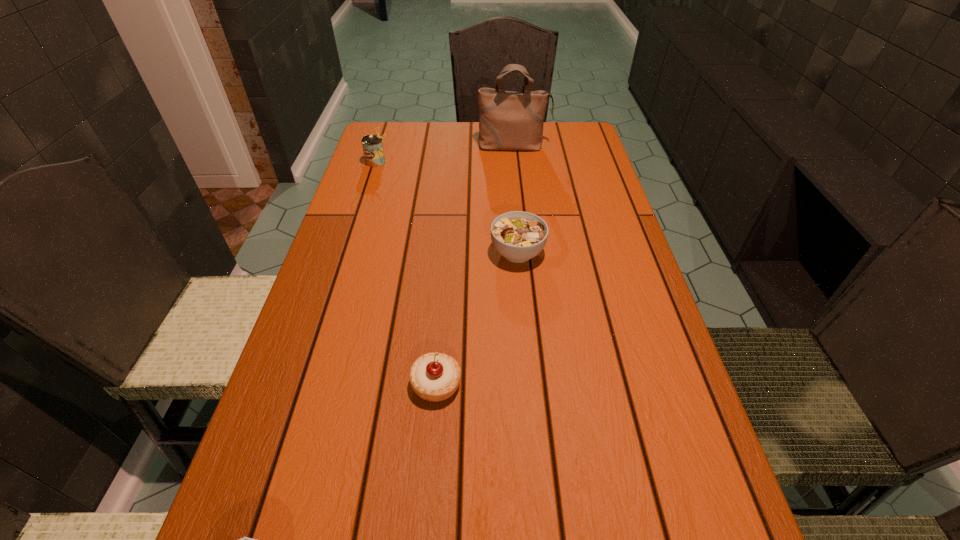
The height and width of the screenshot is (540, 960). In the image, there is a desktop. What are the coordinates of `vacant space at the right edge` in the screenshot? It's located at (579, 223).

In order to click on vacant space at the far left corner of the desktop in this screenshot , I will do click(x=373, y=124).

Locate an element on the screen. free space at the far right corner of the desktop is located at coordinates (561, 136).

At what (x,y) coordinates should I click in order to perform the action: click on blank region between the can and the pastry. Please return your answer as a coordinate pair (x, y). Looking at the image, I should click on (406, 273).

Identify the location of free space between the second tallest object and the farthest object. The image size is (960, 540). (445, 154).

The image size is (960, 540). I want to click on vacant region between the second nearest object and the farther soup bowl, so click(477, 318).

Identify the location of vacant space that's between the tallest object and the farther soup bowl. (516, 199).

The image size is (960, 540). Identify the location of free space between the second farthest object and the farthest object. (445, 154).

I want to click on vacant space in between the farther soup bowl and the farthest object, so click(516, 199).

Identify which object is the fourth nearest to the fourth farthest object. Please provide its 2D coordinates. Your answer should be formatted as a tuple, i.e. [(x, y)], where the tuple contains the x and y coordinates of a point satisfying the conditions above.

[(508, 120)]